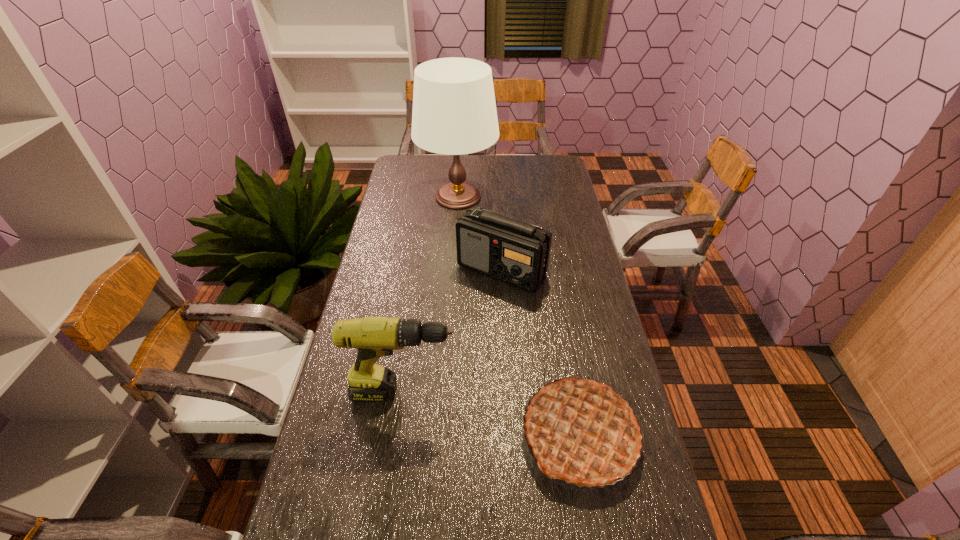
This screenshot has height=540, width=960. I want to click on free point between the pie and the second tallest object, so click(x=492, y=414).

At what (x,y) coordinates should I click in order to perform the action: click on free spot between the second tallest object and the pie. Please return your answer as a coordinate pair (x, y). This screenshot has width=960, height=540. Looking at the image, I should click on (492, 414).

Where is `vacant region between the radio receiver and the pie`? This screenshot has width=960, height=540. vacant region between the radio receiver and the pie is located at coordinates (540, 353).

You are a GUI agent. You are given a task and a screenshot of the screen. Output one action in this format:
    pyautogui.click(x=<x>, y=<y>)
    Task: Click on the free point between the second tallest object and the pie
    This screenshot has height=540, width=960.
    Given the screenshot: What is the action you would take?
    pyautogui.click(x=492, y=414)

The height and width of the screenshot is (540, 960). I want to click on the closest object to the drill, so click(581, 431).

Locate which object ranks second in proximity to the pie. Please provide its 2D coordinates. Your answer should be formatted as a tuple, i.e. [(x, y)], where the tuple contains the x and y coordinates of a point satisfying the conditions above.

[(515, 252)]

Find the location of `vacant space that satisfies the following two spatial constraints: 1. on the handle side of the drill; 2. on the left side of the pie`. vacant space that satisfies the following two spatial constraints: 1. on the handle side of the drill; 2. on the left side of the pie is located at coordinates (398, 436).

In order to click on free space in the image that satisfies the following two spatial constraints: 1. on the front panel of the radio receiver; 2. on the left side of the pie in this screenshot , I will do `click(511, 436)`.